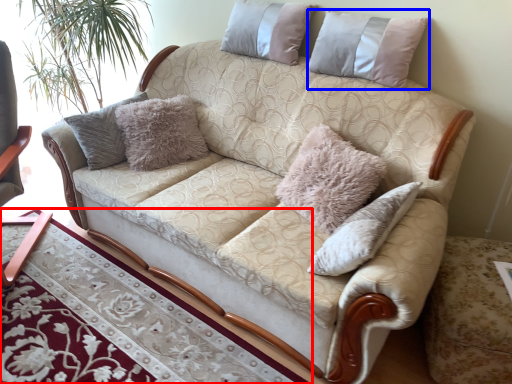
Question: Which point is further to the camera, table (highlighted by a red box) or pillow (highlighted by a blue box)?

Choices:
 (A) table
 (B) pillow

Answer: (B)